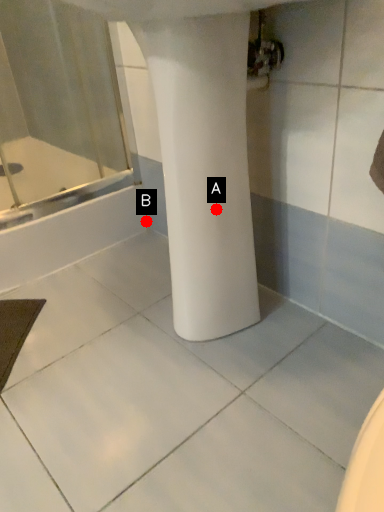
Question: Two points are circled on the image, labeled by A and B beside each circle. Which point is closer to the camera?

Choices:
 (A) A is closer
 (B) B is closer

Answer: (A)